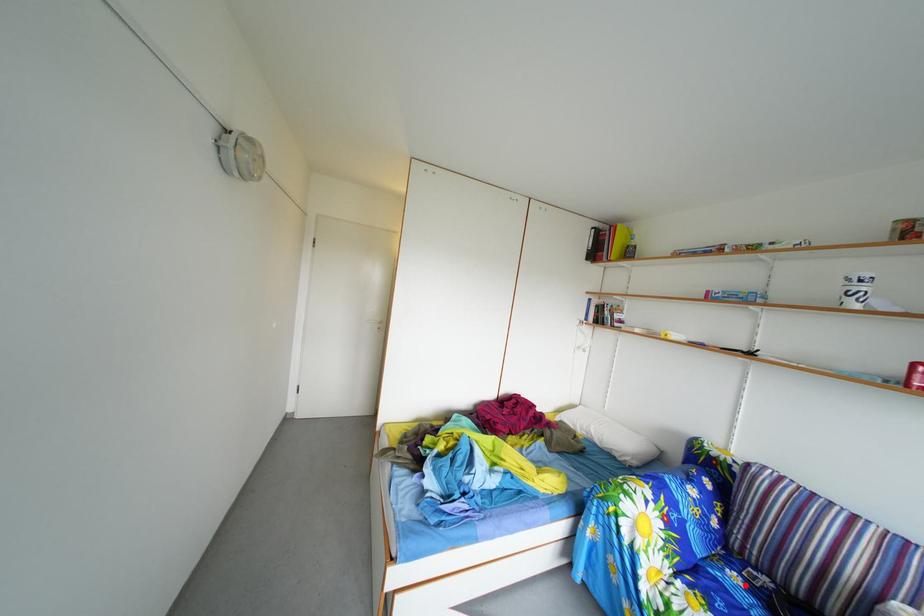
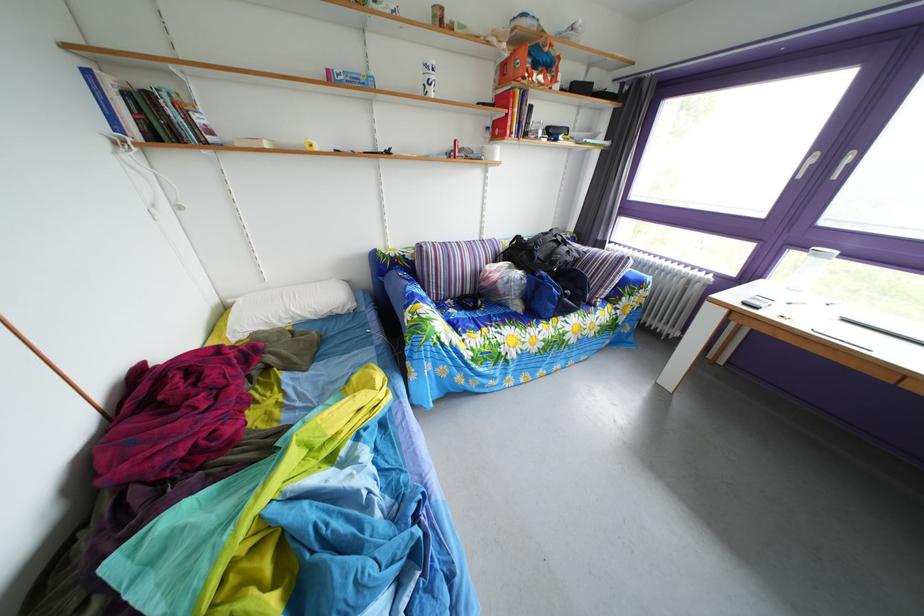
In the second image, find the point that corresponds to the highlighted location in the first image.

(463, 320)